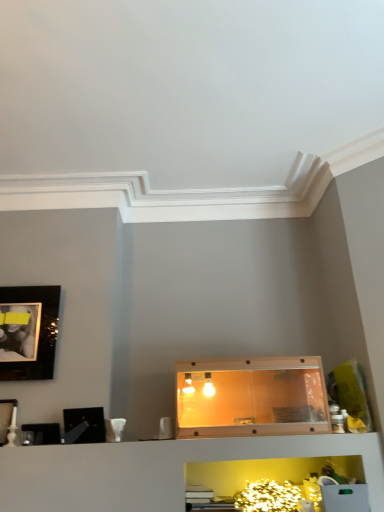
Question: Is black glossy picture frame at left, marked as the third picture frame in a bottom-to-top arrangement, further to camera compared to translucent plastic cabinet at center?

Choices:
 (A) no
 (B) yes

Answer: (A)

Question: Is black glossy picture frame at left, marked as the third picture frame in a bottom-to-top arrangement, positioned beyond the bounds of translucent plastic cabinet at center?

Choices:
 (A) yes
 (B) no

Answer: (A)

Question: From a real-world perspective, is black glossy picture frame at left, marked as the third picture frame in a bottom-to-top arrangement, under translucent plastic cabinet at center?

Choices:
 (A) yes
 (B) no

Answer: (A)

Question: Is black glossy picture frame at left, marked as the third picture frame in a bottom-to-top arrangement, placed right next to translucent plastic cabinet at center?

Choices:
 (A) yes
 (B) no

Answer: (B)

Question: From a real-world perspective, does black glossy picture frame at left, the second picture frame from the top, stand above translucent plastic cabinet at center?

Choices:
 (A) no
 (B) yes

Answer: (A)

Question: From the image's perspective, is matte black picture frame at left, which is counted as the 3th picture frame, starting from the top, located above or below matte black picture frame at upper left, positioned as the 1th picture frame in top-to-bottom order?

Choices:
 (A) above
 (B) below

Answer: (B)

Question: From a real-world perspective, is matte black picture frame at left, which is counted as the 3th picture frame, starting from the top, above or below matte black picture frame at upper left, marked as the 4th picture frame in a bottom-to-top arrangement?

Choices:
 (A) below
 (B) above

Answer: (A)

Question: Looking at the image, does matte black picture frame at left, placed as the 2th picture frame when sorted from bottom to top, seem bigger or smaller compared to matte black picture frame at upper left, marked as the 4th picture frame in a bottom-to-top arrangement?

Choices:
 (A) big
 (B) small

Answer: (B)

Question: Is matte black picture frame at left, which is counted as the 3th picture frame, starting from the top, taller or shorter than matte black picture frame at upper left, marked as the 4th picture frame in a bottom-to-top arrangement?

Choices:
 (A) short
 (B) tall

Answer: (A)

Question: Is matte black picture frame at lower left, the 4th picture frame when ordered from top to bottom, taller or shorter than black glossy picture frame at left, marked as the third picture frame in a bottom-to-top arrangement?

Choices:
 (A) short
 (B) tall

Answer: (A)

Question: Is matte black picture frame at lower left, marked as the 1th picture frame in a bottom-to-top arrangement, in front of or behind black glossy picture frame at left, the second picture frame from the top, in the image?

Choices:
 (A) behind
 (B) front

Answer: (A)

Question: Is point (54, 437) positioned closer to the camera than point (104, 436)?

Choices:
 (A) closer
 (B) farther

Answer: (B)

Question: From a real-world perspective, is matte black picture frame at lower left, marked as the 1th picture frame in a bottom-to-top arrangement, positioned above or below black glossy picture frame at left, marked as the third picture frame in a bottom-to-top arrangement?

Choices:
 (A) below
 (B) above

Answer: (A)

Question: Based on their positions, is matte black picture frame at upper left, marked as the 4th picture frame in a bottom-to-top arrangement, located to the left or right of black glossy picture frame at left, marked as the third picture frame in a bottom-to-top arrangement?

Choices:
 (A) left
 (B) right

Answer: (A)

Question: Is point (14, 290) closer or farther from the camera than point (91, 414)?

Choices:
 (A) farther
 (B) closer

Answer: (A)